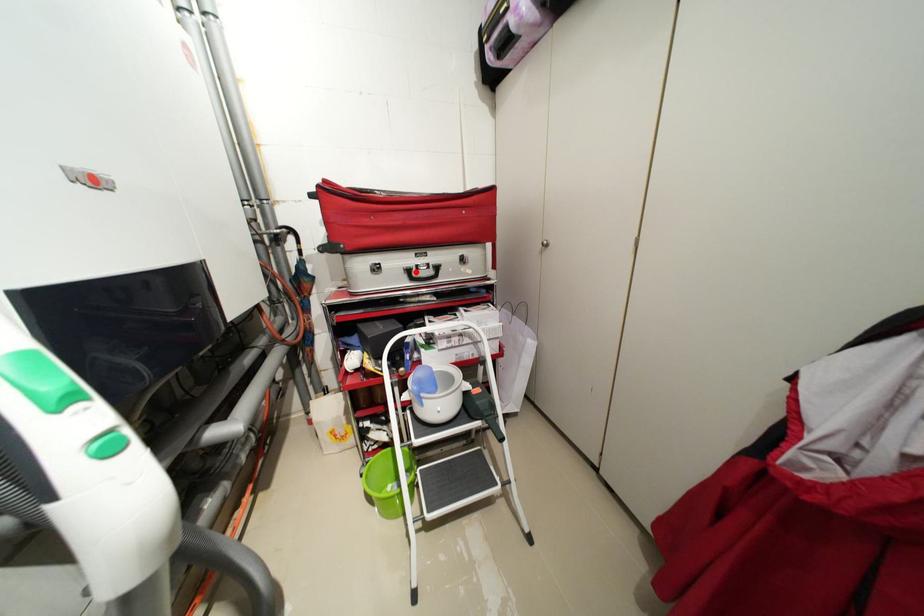
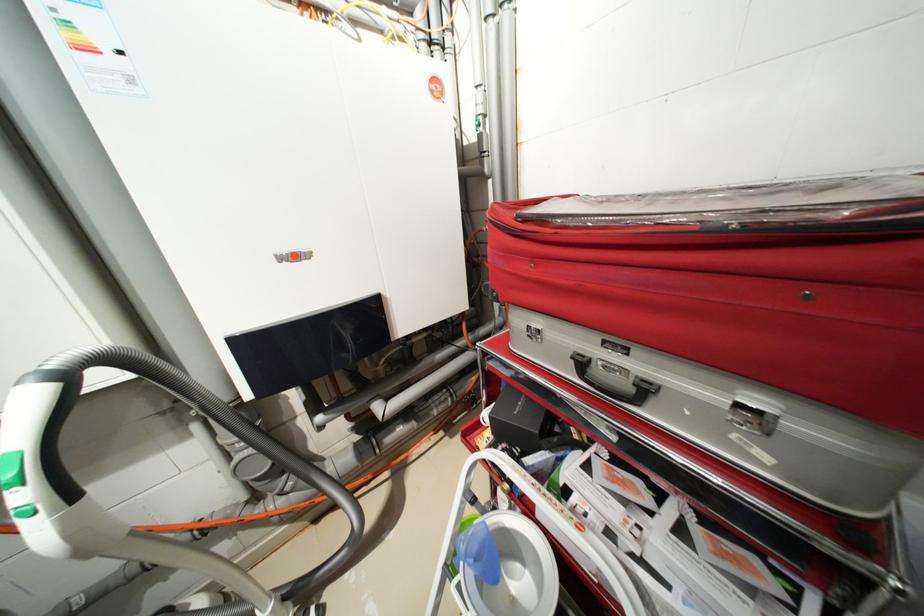
Where in the second image is the point corresponding to the highlighted location from the first image?

(589, 363)